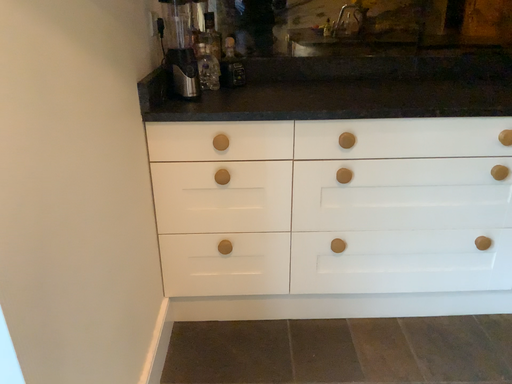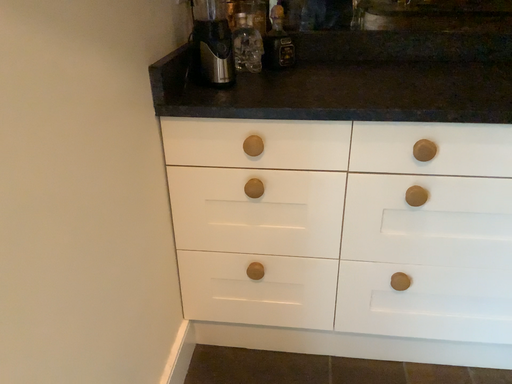
Question: How did the camera likely rotate when shooting the video?

Choices:
 (A) rotated right
 (B) rotated left

Answer: (B)